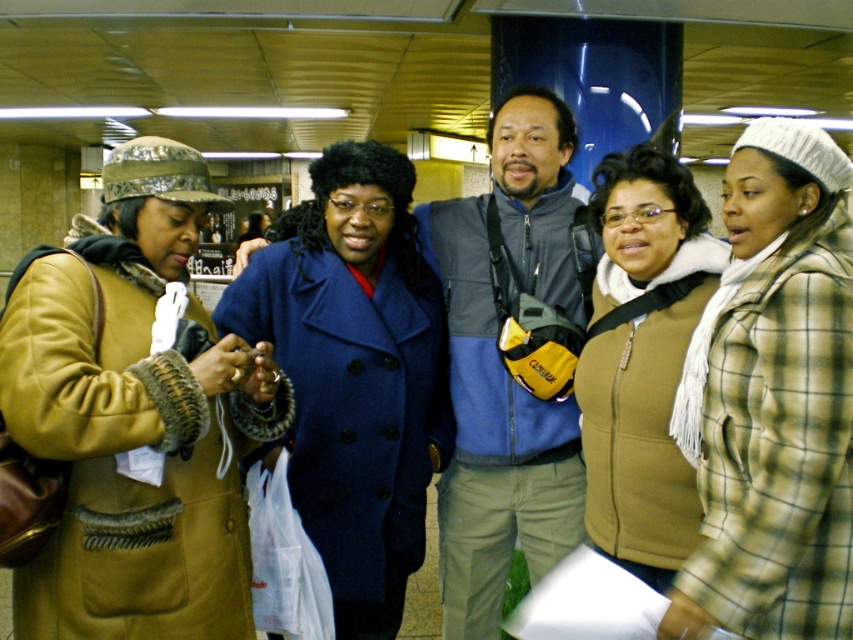
Question: Can you confirm if plaid woolen jacket at center is wider than matte blue coat at center?

Choices:
 (A) yes
 (B) no

Answer: (B)

Question: Which point is farther to the camera?

Choices:
 (A) (456, 621)
 (B) (808, 547)
 (C) (345, 508)

Answer: (A)

Question: Is plaid woolen jacket at center above blue fleece vest at center?

Choices:
 (A) no
 (B) yes

Answer: (B)

Question: Can you confirm if plaid woolen jacket at center is thinner than blue fleece vest at center?

Choices:
 (A) no
 (B) yes

Answer: (B)

Question: Which object is closer to the camera taking this photo?

Choices:
 (A) blue fleece vest at center
 (B) matte blue coat at center
 (C) plaid woolen jacket at center
 (D) matte brown vest at center

Answer: (C)

Question: Estimate the real-world distances between objects in this image. Which object is farther from the plaid woolen jacket at center?

Choices:
 (A) blue fleece vest at center
 (B) matte brown vest at center
 (C) leather jacket at left

Answer: (C)